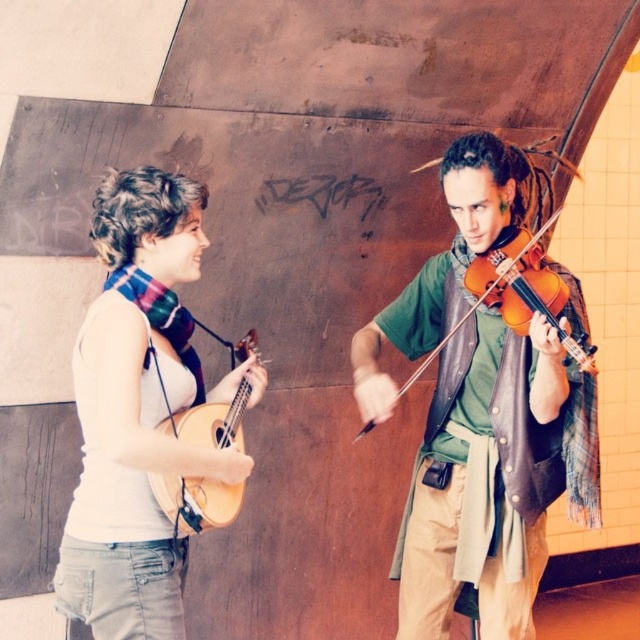
Question: Which point appears farthest from the camera in this image?

Choices:
 (A) pos(451,579)
 (B) pos(225,499)

Answer: (A)

Question: Which is farther from the white matte guitar at left?

Choices:
 (A) orange matte violin at right
 (B) light brown wooden ukulele at left
 (C) matte green shirt at center

Answer: (C)

Question: Can you confirm if matte green shirt at center is bigger than orange matte violin at right?

Choices:
 (A) no
 (B) yes

Answer: (B)

Question: In this image, where is matte green shirt at center located relative to orange matte violin at right?

Choices:
 (A) left
 (B) right

Answer: (B)

Question: Which of the following is the closest to the observer?

Choices:
 (A) white matte guitar at left
 (B) orange matte violin at right

Answer: (A)

Question: Does white matte guitar at left come behind light brown wooden ukulele at left?

Choices:
 (A) yes
 (B) no

Answer: (B)